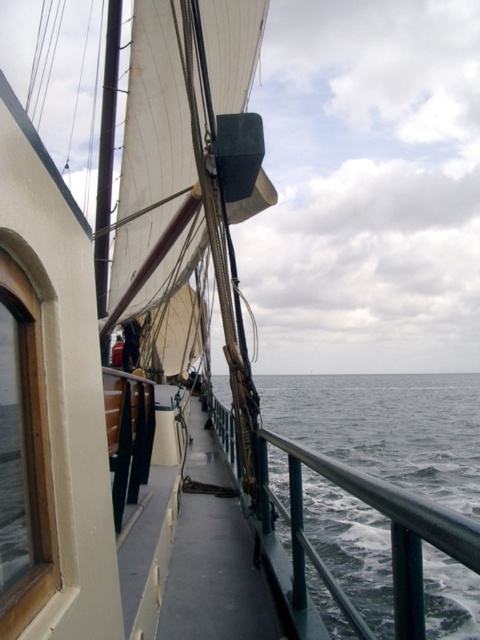
Question: Is gray matte water at center smaller than dark blue fabric at center?

Choices:
 (A) yes
 (B) no

Answer: (B)

Question: Which point is farther from the camera taking this photo?

Choices:
 (A) (331, 448)
 (B) (112, 348)

Answer: (A)

Question: Which object is closer to the camera taking this photo?

Choices:
 (A) gray matte water at center
 (B) dark blue fabric at center

Answer: (A)

Question: Is gray matte water at center bigger than dark blue fabric at center?

Choices:
 (A) yes
 (B) no

Answer: (A)

Question: Where is gray matte water at center located in relation to dark blue fabric at center in the image?

Choices:
 (A) above
 (B) below

Answer: (B)